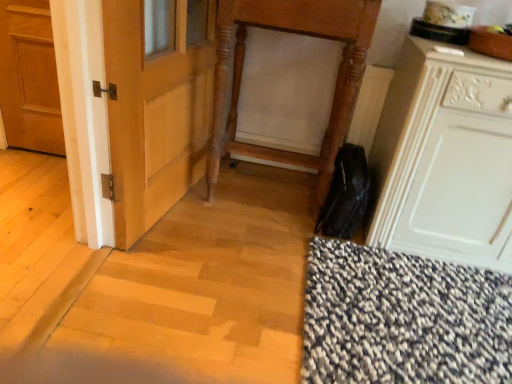
Measure the distance between wooden carved vanity at center and camera.

wooden carved vanity at center and camera are 5.02 feet apart from each other.

Measure the distance between white matte cabinet at lower right and camera.

white matte cabinet at lower right is 4.64 feet from camera.

The width and height of the screenshot is (512, 384). I want to click on white matte cabinet at lower right, so click(x=445, y=158).

Describe the element at coordinates (29, 78) in the screenshot. I see `matte wooden door at left` at that location.

Where is `wooden carved vanity at center`? This screenshot has height=384, width=512. wooden carved vanity at center is located at coordinates (296, 33).

Is wooden carved vanity at center inside the boundaries of white matte cabinet at lower right, or outside?

wooden carved vanity at center is spatially situated outside white matte cabinet at lower right.

Does wooden carved vanity at center turn towards white matte cabinet at lower right?

No, wooden carved vanity at center does not turn towards white matte cabinet at lower right.

How much distance is there between wooden carved vanity at center and white matte cabinet at lower right?

wooden carved vanity at center is 19.33 inches from white matte cabinet at lower right.

Is wooden carved vanity at center thinner than white matte cabinet at lower right?

Correct, the width of wooden carved vanity at center is less than that of white matte cabinet at lower right.

Is there a large distance between white matte cabinet at lower right and wooden carved vanity at center?

They are positioned close to each other.

Considering the positions of objects white matte cabinet at lower right and wooden carved vanity at center in the image provided, who is more to the right, white matte cabinet at lower right or wooden carved vanity at center?

Positioned to the right is white matte cabinet at lower right.

From a real-world perspective, between white matte cabinet at lower right and wooden carved vanity at center, who is vertically lower?

white matte cabinet at lower right, from a real-world perspective.

Which point is more forward, (460, 173) or (302, 17)?

The point (460, 173) is more forward.

Is the position of white matte cabinet at lower right less distant than that of matte wooden door at left?

Yes, white matte cabinet at lower right is in front of matte wooden door at left.

Considering the relative sizes of white matte cabinet at lower right and matte wooden door at left in the image provided, is white matte cabinet at lower right wider than matte wooden door at left?

Yes.

Is matte wooden door at left at the back of white matte cabinet at lower right?

No, white matte cabinet at lower right is not facing away from matte wooden door at left.

From a real-world perspective, is white matte cabinet at lower right physically above matte wooden door at left?

Yes, from a real-world perspective, white matte cabinet at lower right is on top of matte wooden door at left.

Does wooden carved vanity at center turn towards matte wooden door at left?

No, wooden carved vanity at center does not turn towards matte wooden door at left.

Is wooden carved vanity at center not inside matte wooden door at left?

wooden carved vanity at center lies outside matte wooden door at left's area.

Consider the image. Does wooden carved vanity at center have a greater width compared to matte wooden door at left?

Yes.

Is point (45, 51) more distant than point (285, 22)?

Yes, it is behind point (285, 22).

Who is bigger, matte wooden door at left or wooden carved vanity at center?

wooden carved vanity at center.

From the image's perspective, does matte wooden door at left appear lower than wooden carved vanity at center?

Actually, matte wooden door at left appears above wooden carved vanity at center in the image.

Which object is more forward, matte wooden door at left or wooden carved vanity at center?

wooden carved vanity at center is in front.

This screenshot has height=384, width=512. Find the location of `door below the white matte cabinet at lower right (from a real-world perspective)`. door below the white matte cabinet at lower right (from a real-world perspective) is located at coordinates (29, 78).

Is matte wooden door at left inside or outside of white matte cabinet at lower right?

matte wooden door at left is not inside white matte cabinet at lower right, it's outside.

Which of these two, matte wooden door at left or white matte cabinet at lower right, stands taller?

white matte cabinet at lower right is taller.

Is matte wooden door at left oriented away from white matte cabinet at lower right?

No.

This screenshot has width=512, height=384. In order to click on cabinetry located on the right of wooden carved vanity at center in this screenshot , I will do (445, 158).

This screenshot has height=384, width=512. In order to click on vanity that appears above the white matte cabinet at lower right (from the image's perspective) in this screenshot , I will do `click(296, 33)`.

From the image, which object appears to be farther from wooden carved vanity at center, matte wooden door at left or white matte cabinet at lower right?

matte wooden door at left lies further to wooden carved vanity at center than the other object.

Consider the image. Estimate the real-world distances between objects in this image. Which object is further from white matte cabinet at lower right, wooden carved vanity at center or matte wooden door at left?

The object further to white matte cabinet at lower right is matte wooden door at left.

Estimate the real-world distances between objects in this image. Which object is further from matte wooden door at left, white matte cabinet at lower right or wooden carved vanity at center?

Based on the image, white matte cabinet at lower right appears to be further to matte wooden door at left.

From the image, which object appears to be nearer to wooden carved vanity at center, white matte cabinet at lower right or matte wooden door at left?

white matte cabinet at lower right is positioned closer to the anchor wooden carved vanity at center.

Based on the photo, looking at the image, which one is located further to white matte cabinet at lower right, matte wooden door at left or wooden carved vanity at center?

Based on the image, matte wooden door at left appears to be further to white matte cabinet at lower right.

Consider the image. Based on their spatial positions, is wooden carved vanity at center or white matte cabinet at lower right further from matte wooden door at left?

The object further to matte wooden door at left is white matte cabinet at lower right.

Locate an element on the screen. Image resolution: width=512 pixels, height=384 pixels. vanity between matte wooden door at left and white matte cabinet at lower right from left to right is located at coordinates (296, 33).